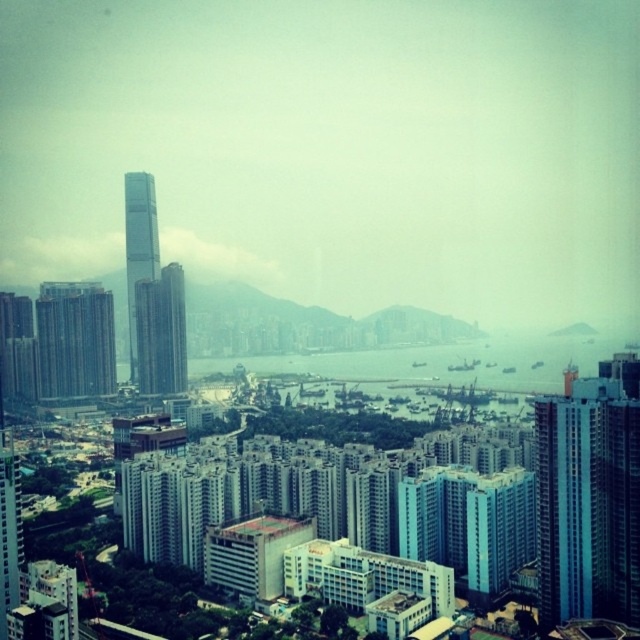
Does blue water at center appear on the left side of glassy skyscraper at left?

Incorrect, blue water at center is not on the left side of glassy skyscraper at left.

Between blue water at center and glassy skyscraper at left, which one is positioned lower?

blue water at center is below.

Between point (364, 353) and point (147, 204), which one is positioned behind?

Point (364, 353)

Locate an element on the screen. The width and height of the screenshot is (640, 640). blue water at center is located at coordinates (428, 369).

Which is in front, point (396, 353) or point (80, 372)?

Point (80, 372) is more forward.

Who is positioned more to the right, blue water at center or blue glass building at left?

Positioned to the right is blue water at center.

Who is more forward, (554,372) or (58,378)?

Point (58,378) is in front.

What are the coordinates of `blue water at center` in the screenshot? It's located at (428, 369).

What do you see at coordinates (76, 340) in the screenshot?
I see `blue glass building at left` at bounding box center [76, 340].

Can you confirm if blue glass building at left is positioned to the left of glassy steel skyscraper at center-left?

Indeed, blue glass building at left is positioned on the left side of glassy steel skyscraper at center-left.

The height and width of the screenshot is (640, 640). What do you see at coordinates (76, 340) in the screenshot? I see `blue glass building at left` at bounding box center [76, 340].

Identify the location of blue glass building at left. The image size is (640, 640). (76, 340).